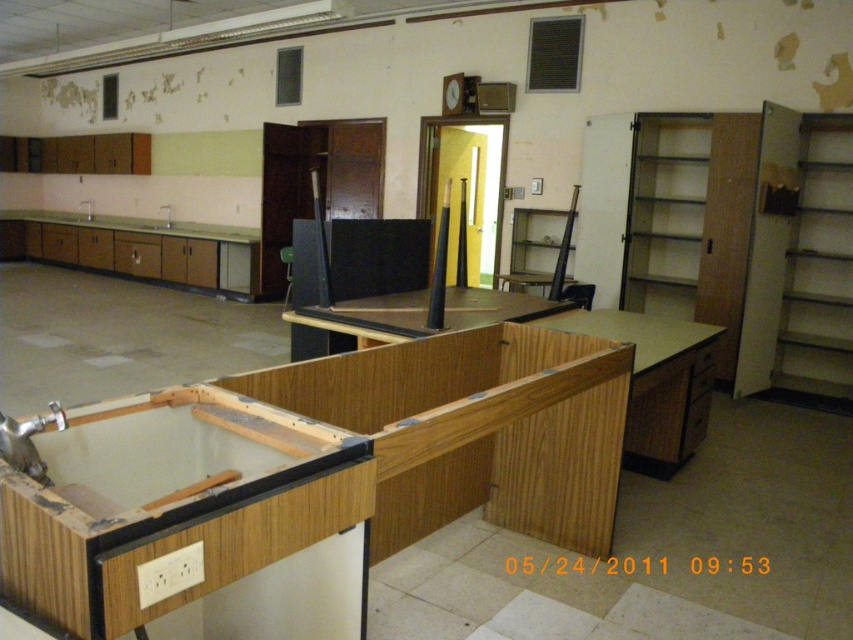
Question: Is white glossy sink at left closer to camera compared to white glossy sink at lower left?

Choices:
 (A) yes
 (B) no

Answer: (A)

Question: Which object appears farthest from the camera in this image?

Choices:
 (A) white glossy sink at lower left
 (B) white glossy sink at left
 (C) white glossy sink at center

Answer: (A)

Question: Does white glossy sink at center appear on the left side of white glossy sink at lower left?

Choices:
 (A) yes
 (B) no

Answer: (B)

Question: Is white glossy sink at center positioned behind white glossy sink at lower left?

Choices:
 (A) no
 (B) yes

Answer: (A)

Question: Which object is farther from the camera taking this photo?

Choices:
 (A) white glossy sink at left
 (B) white glossy sink at lower left
 (C) white glossy sink at center

Answer: (B)

Question: Which point is closer to the camera?

Choices:
 (A) white glossy sink at center
 (B) white glossy sink at lower left
 (C) white glossy sink at left

Answer: (A)